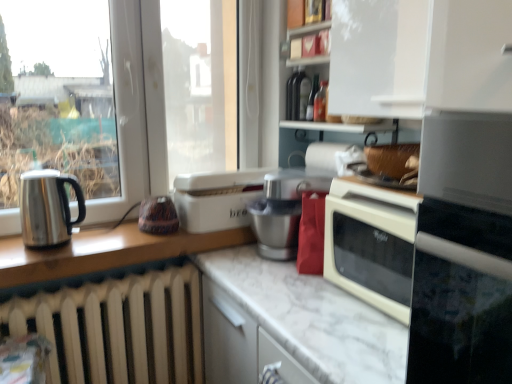
This screenshot has width=512, height=384. I want to click on vacant area that is in front of metallic silver food processor at center, so (x=270, y=283).